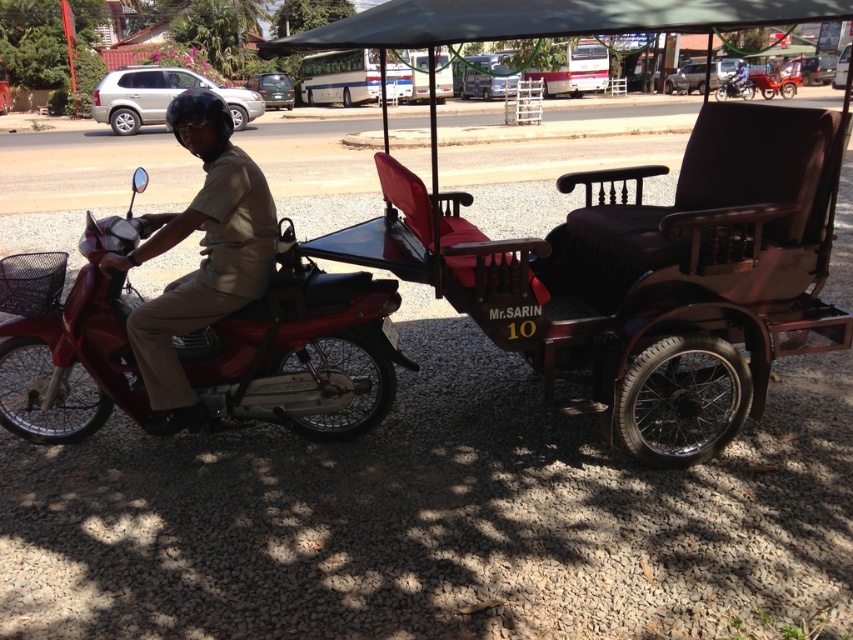
You are standing at the origin point of the image coordinate system, which is the bottom left corner. The image coordinate system has the x axis pointing to the right and the y axis pointing upward. You want to walk to the shiny red motorcycle at left. Which direction should you go? Please answer with either left, right, forward, backward, or a combination of these directions separated by commas.

Since the shiny red motorcycle at left is located at point (299, 349) in the image coordinate system, which has the origin at the bottom left corner, the x coordinate of 0.548 means it is 54.8 percent of the way to the right edge, and the y coordinate of 0.352 means it is 35.2 percent of the way upward from the bottom. Therefore, to reach the shiny red motorcycle at left, you should move right and forward from your current position at the origin.

You are a delivery person who needs to place a package in the shiny red motorcycle at left. The package is 3 meters long. Can you fit it in the motorcycle?

The distance between the shiny red motorcycle at left and camera is 3.35 meters, but the package length is 3 meters. However, the description does not provide the motorcycle length, so it is unclear if the package will fit. More information is needed.